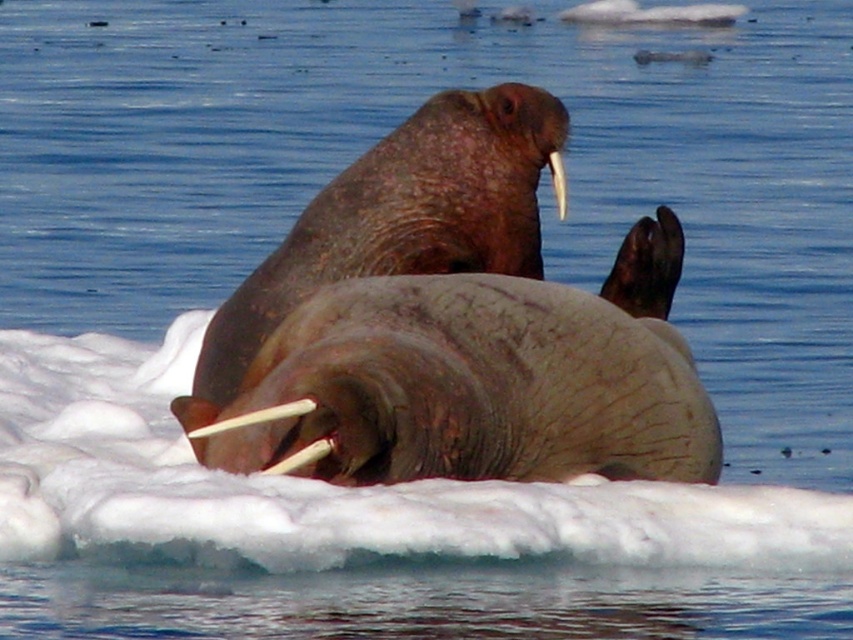
You are a wildlife photographer aiming to capture the walrus in the image. Given that the gray textured walrus at center is larger than the white ivory tusk at center, which object should you focus on to ensure the entire body of the walrus fits in the frame?

You should focus on the gray textured walrus at center since it is larger than the white ivory tusk at center, ensuring the entire body fits in the frame.

You are standing at the edge of the ice patch and want to approach the gray textured walrus at center. The coordinates of the walrus are at point (480, 378). If you move straight towards the walrus, will you step into the water?

The point (480, 378) marks the gray textured walrus at center, so moving straight towards it would mean approaching the walrus on the ice patch. Since the walrus is on the ice, you would not step into the water unless you go past the ice patch.